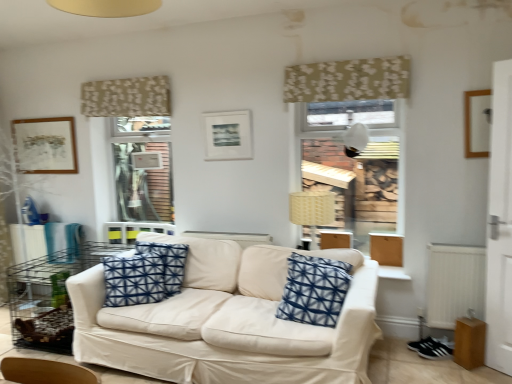
Question: In the image, is beige floral fabric at upper center, marked as the 2th curtain in a right-to-left arrangement, on the left side or the right side of matte brown picture frame at upper left, the first picture frame from the back?

Choices:
 (A) right
 (B) left

Answer: (A)

Question: Is point (90, 89) positioned closer to the camera than point (72, 160)?

Choices:
 (A) farther
 (B) closer

Answer: (B)

Question: Estimate the real-world distances between objects in this image. Which object is farther from the blue printed cushion at center, marked as the second pillow in a left-to-right arrangement?

Choices:
 (A) matte black picture frame at center, the second picture frame when ordered from left to right
 (B) matte brown picture frame at upper left, placed as the 1th picture frame when sorted from left to right
 (C) wooden picture frame at upper right, the 1th picture frame in the right-to-left sequence
 (D) blue printed cushion at center, positioned as the second pillow in right-to-left order
 (E) beige floral fabric at upper center, acting as the second curtain starting from the front

Answer: (B)

Question: Based on their relative distances, which object is farther from the blue printed cushion at center, positioned as the second pillow in right-to-left order?

Choices:
 (A) white plastic radiator at lower right
 (B) wooden picture frame at upper right, positioned as the 1th picture frame in front-to-back order
 (C) beige floral fabric at upper center, the 1th curtain when ordered from back to front
 (D) matte brown picture frame at upper left, placed as the 1th picture frame when sorted from left to right
 (E) beige floral fabric at upper center, arranged as the 1th curtain when viewed from the right

Answer: (B)